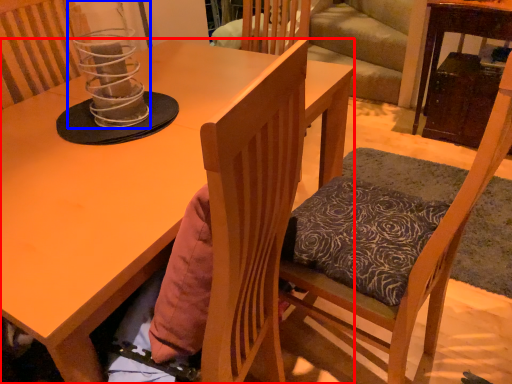
Question: Which object is further to the camera taking this photo, desk (highlighted by a red box) or candle holder (highlighted by a blue box)?

Choices:
 (A) desk
 (B) candle holder

Answer: (B)